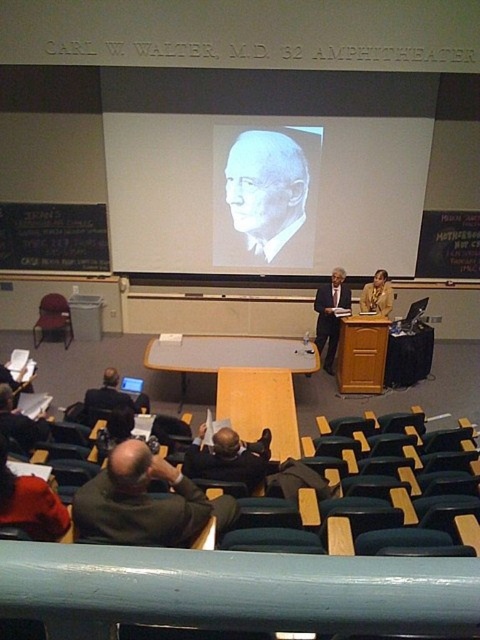
You are an event organizer who needs to place a 2.5 meter long banner between the gray matte portrait at center and the matte gold jacket at center. Is there enough space to place it without overlapping either object?

The distance between the gray matte portrait at center and the matte gold jacket at center is 1.81 meters. Since the banner is 2.5 meters long, it is longer than the available space, so it will overlap both objects. Therefore, the banner cannot be placed without overlapping.

You are sitting in the Carl W. Walter, M.D., 32 Amphitheater. You notice a dark suit at center and a matte black laptop at left. Which object is positioned higher from the ground?

The dark suit at center is above matte black laptop at left, so the dark suit at center is higher from the ground.